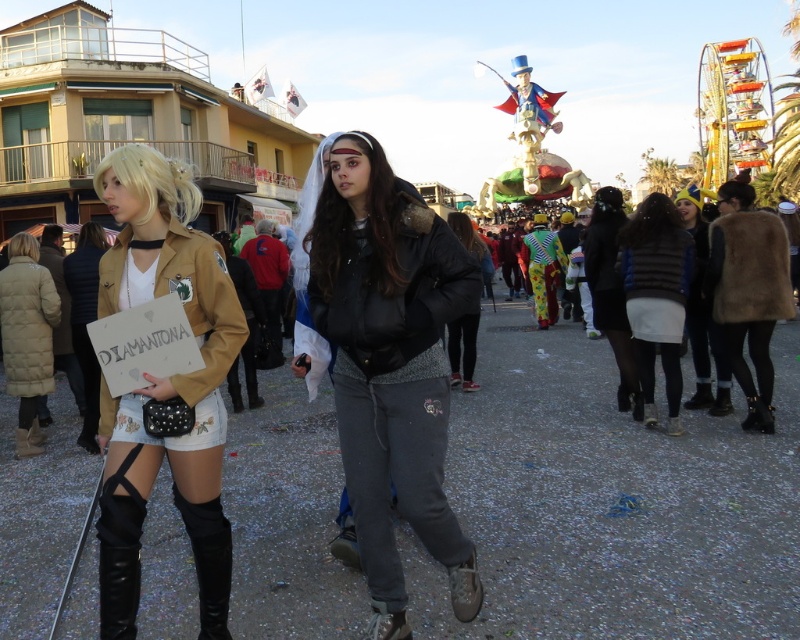
You are an observer standing in the middle of the street. You see the matte black jacket at center and the striped sweater at right. Which object is positioned lower in the scene?

The matte black jacket at center is positioned lower than the striped sweater at right in the scene.

You are designing a clothing rack for a store and need to place both the matte brown jacket at center and the black leather jacket at center side by side. Given their widths, which jacket should be placed on the narrower side of the rack to ensure they fit properly?

The matte brown jacket at center has a smaller width than the black leather jacket at center, so it should be placed on the narrower side of the rack to accommodate both jackets properly.